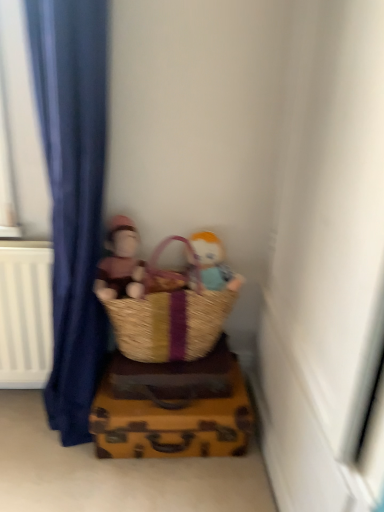
Question: Is brown woven basket at lower center outside of soft plush toy at center, arranged as the first person when viewed from the left?

Choices:
 (A) yes
 (B) no

Answer: (A)

Question: Does brown woven basket at lower center have a lesser height compared to soft plush toy at center, arranged as the first person when viewed from the left?

Choices:
 (A) yes
 (B) no

Answer: (A)

Question: Is soft plush toy at center, the 2th person from the right, at the back of brown woven basket at lower center?

Choices:
 (A) no
 (B) yes

Answer: (A)

Question: From the image's perspective, does brown woven basket at lower center appear higher than soft plush toy at center, the 2th person from the right?

Choices:
 (A) yes
 (B) no

Answer: (B)

Question: Can you confirm if brown woven basket at lower center is wider than soft plush toy at center, arranged as the first person when viewed from the left?

Choices:
 (A) yes
 (B) no

Answer: (A)

Question: Is brown woven basket at lower center touching soft plush toy at center, the 2th person from the right?

Choices:
 (A) no
 (B) yes

Answer: (A)

Question: From the image's perspective, is soft plush toy at center, arranged as the first person when viewed from the left, over brown woven picnic basket at lower center?

Choices:
 (A) no
 (B) yes

Answer: (B)

Question: Is the depth of soft plush toy at center, arranged as the first person when viewed from the left, greater than that of brown woven picnic basket at lower center?

Choices:
 (A) no
 (B) yes

Answer: (B)

Question: Considering the relative positions of soft plush toy at center, the 2th person from the right, and brown woven picnic basket at lower center in the image provided, is soft plush toy at center, the 2th person from the right, to the left of brown woven picnic basket at lower center from the viewer's perspective?

Choices:
 (A) no
 (B) yes

Answer: (B)

Question: Considering the relative sizes of soft plush toy at center, the 2th person from the right, and brown woven picnic basket at lower center in the image provided, is soft plush toy at center, the 2th person from the right, wider than brown woven picnic basket at lower center?

Choices:
 (A) yes
 (B) no

Answer: (B)

Question: Considering the relative sizes of soft plush toy at center, the 2th person from the right, and brown woven picnic basket at lower center in the image provided, is soft plush toy at center, the 2th person from the right, thinner than brown woven picnic basket at lower center?

Choices:
 (A) no
 (B) yes

Answer: (B)

Question: Can we say soft plush toy at center, arranged as the first person when viewed from the left, lies outside brown woven picnic basket at lower center?

Choices:
 (A) no
 (B) yes

Answer: (A)

Question: From the image's perspective, does brown woven picnic basket at lower center appear lower than brown woven basket at lower center?

Choices:
 (A) yes
 (B) no

Answer: (B)